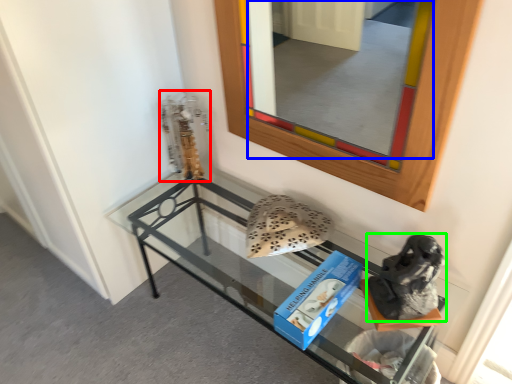
Question: Considering the real-world distances, which object is closest to sculpture (highlighted by a red box)? mirror (highlighted by a blue box) or footwear (highlighted by a green box).

Choices:
 (A) mirror
 (B) footwear

Answer: (B)